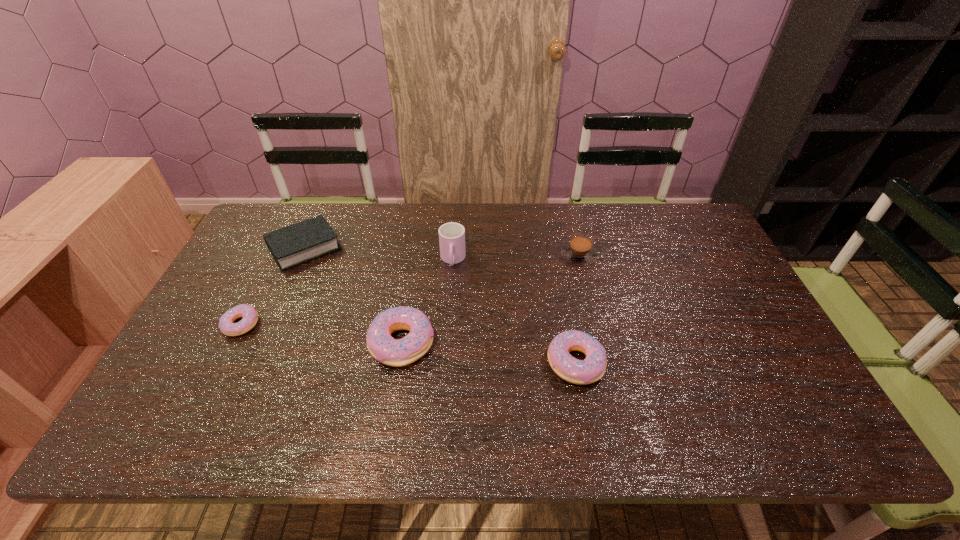
Locate an element on the screen. This screenshot has height=540, width=960. vacant space at the near edge of the desktop is located at coordinates (250, 390).

Identify the location of vacant space at the right edge of the desktop. Image resolution: width=960 pixels, height=540 pixels. (730, 286).

At what (x,y) coordinates should I click in order to perform the action: click on vacant space at the far left corner of the desktop. Please return your answer as a coordinate pair (x, y). Looking at the image, I should click on (254, 232).

In the image, there is a desktop. At what (x,y) coordinates should I click in order to perform the action: click on vacant region at the far right corner. Please return your answer as a coordinate pair (x, y). The height and width of the screenshot is (540, 960). Looking at the image, I should click on (678, 203).

Where is `vacant space that's between the second doughnut from right to left and the second tallest doughnut`? The width and height of the screenshot is (960, 540). vacant space that's between the second doughnut from right to left and the second tallest doughnut is located at coordinates (489, 353).

At what (x,y) coordinates should I click in order to perform the action: click on free spot between the cappuccino and the rightmost doughnut. Please return your answer as a coordinate pair (x, y). The width and height of the screenshot is (960, 540). Looking at the image, I should click on (577, 309).

This screenshot has width=960, height=540. Find the location of `free point between the cup and the second doughnut from left to right`. free point between the cup and the second doughnut from left to right is located at coordinates (427, 301).

What are the coordinates of `vacant space in between the leftmost doughnut and the second doughnut from right to left` in the screenshot? It's located at (322, 334).

Locate an element on the screen. The width and height of the screenshot is (960, 540). free area in between the cappuccino and the tallest object is located at coordinates (516, 258).

Find the location of `unoccupied area between the second shortest doughnut and the second doughnut from right to left`. unoccupied area between the second shortest doughnut and the second doughnut from right to left is located at coordinates (489, 353).